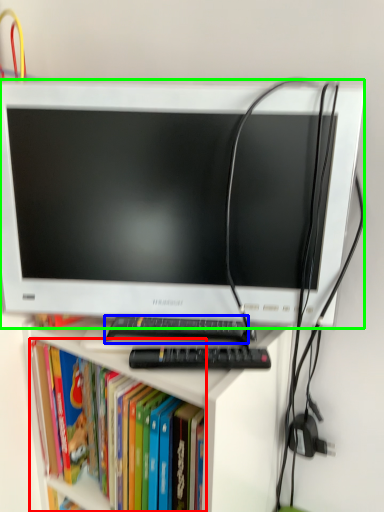
Question: Which object is positioned closest to book (highlighted by a red box)? Select from keyboard (highlighted by a blue box) and computer monitor (highlighted by a green box).

Choices:
 (A) keyboard
 (B) computer monitor

Answer: (A)